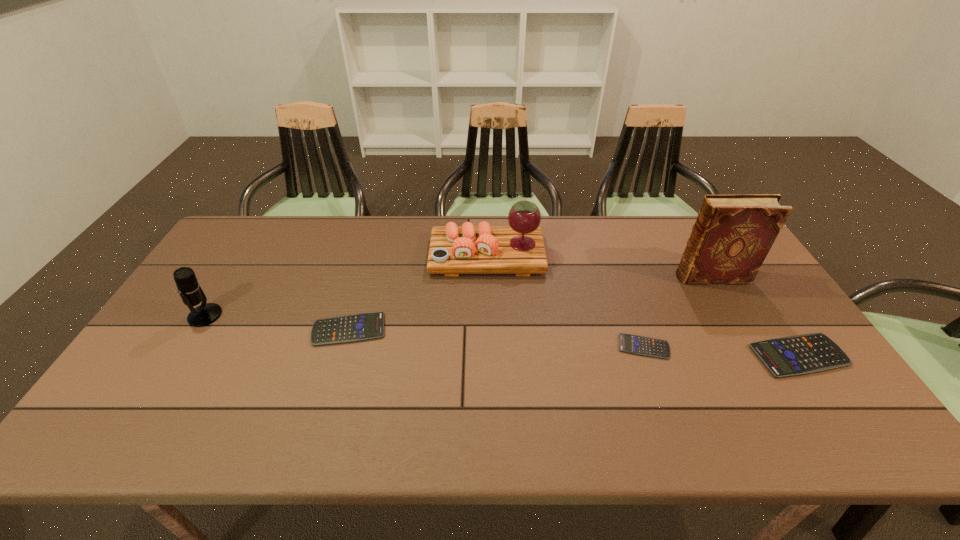
The image size is (960, 540). Find the location of `free space between the rightmost calculator and the tallest object`. free space between the rightmost calculator and the tallest object is located at coordinates (756, 316).

Identify the location of free spot between the leftmost calculator and the hardback book. This screenshot has height=540, width=960. (531, 303).

This screenshot has height=540, width=960. Identify the location of free spot between the tallest object and the rightmost calculator. (756, 316).

Find the location of `free space between the rightmost calculator and the fourth object from right to left`. free space between the rightmost calculator and the fourth object from right to left is located at coordinates (643, 306).

The height and width of the screenshot is (540, 960). What are the coordinates of `vacant area between the hardback book and the microphone` in the screenshot? It's located at (459, 296).

What are the coordinates of `empty location between the second calculator from left to right and the microphone` in the screenshot? It's located at (424, 331).

Where is `free space between the platter and the second calculator from left to right`? Image resolution: width=960 pixels, height=540 pixels. free space between the platter and the second calculator from left to right is located at coordinates (565, 301).

Select which object is the second closest to the platter. Please provide its 2D coordinates. Your answer should be formatted as a tuple, i.e. [(x, y)], where the tuple contains the x and y coordinates of a point satisfying the conditions above.

[(634, 344)]

This screenshot has height=540, width=960. Identify the location of object that ranks as the fifth closest to the microphone. (803, 354).

Locate which calculator is the second closest to the second shortest object. Please provide its 2D coordinates. Your answer should be formatted as a tuple, i.e. [(x, y)], where the tuple contains the x and y coordinates of a point satisfying the conditions above.

[(803, 354)]